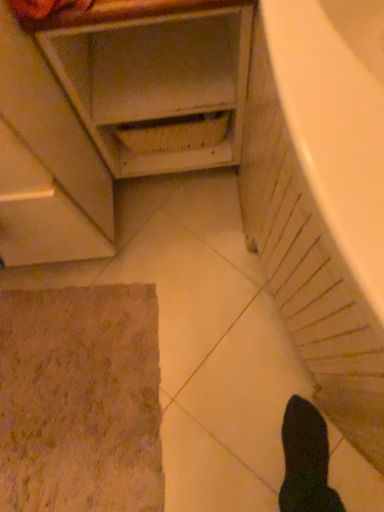
The image size is (384, 512). I want to click on matte white cabinet at upper left, so click(x=121, y=112).

Identify the location of bath mat that is behind the white glossy bathtub at lower right. (80, 400).

Which is closer to the camera, [60,302] or [360,254]?

Point [60,302] is positioned farther from the camera compared to point [360,254].

Which of these two, brown textured bath mat at lower left or white glossy bathtub at lower right, is smaller?

With smaller size is brown textured bath mat at lower left.

Can you confirm if brown textured bath mat at lower left is positioned to the right of white glossy bathtub at lower right?

No.

Looking at this image, based on their sizes in the image, would you say matte white cabinet at upper left is bigger or smaller than brown textured bath mat at lower left?

In the image, matte white cabinet at upper left appears to be larger than brown textured bath mat at lower left.

In the scene shown: Is matte white cabinet at upper left far away from brown textured bath mat at lower left?

They are positioned close to each other.

Can you confirm if matte white cabinet at upper left is positioned to the left of brown textured bath mat at lower left?

Incorrect, matte white cabinet at upper left is not on the left side of brown textured bath mat at lower left.

Considering the positions of objects matte white cabinet at upper left and brown textured bath mat at lower left in the image provided, who is behind, matte white cabinet at upper left or brown textured bath mat at lower left?

brown textured bath mat at lower left.

Is white glossy bathtub at lower right to the left of brown textured bath mat at lower left from the viewer's perspective?

Incorrect, white glossy bathtub at lower right is not on the left side of brown textured bath mat at lower left.

From a real-world perspective, between white glossy bathtub at lower right and brown textured bath mat at lower left, who is vertically lower?

From a 3D spatial view, brown textured bath mat at lower left is below.

Measure the distance from white glossy bathtub at lower right to brown textured bath mat at lower left.

19.75 inches.

Is white glossy bathtub at lower right facing towards brown textured bath mat at lower left?

Yes, white glossy bathtub at lower right is turned towards brown textured bath mat at lower left.

From a real-world perspective, is white glossy bathtub at lower right located higher than matte white cabinet at upper left?

Yes, from a real-world perspective, white glossy bathtub at lower right is above matte white cabinet at upper left.

In the scene shown: Would you say white glossy bathtub at lower right is a long distance from matte white cabinet at upper left?

white glossy bathtub at lower right is actually quite close to matte white cabinet at upper left.

Is white glossy bathtub at lower right to the left of matte white cabinet at upper left from the viewer's perspective?

Incorrect, white glossy bathtub at lower right is not on the left side of matte white cabinet at upper left.

In terms of height, does brown textured bath mat at lower left look taller or shorter compared to matte white cabinet at upper left?

brown textured bath mat at lower left is shorter than matte white cabinet at upper left.

Is brown textured bath mat at lower left directly adjacent to matte white cabinet at upper left?

No, brown textured bath mat at lower left is not next to matte white cabinet at upper left.

Looking at the image, does brown textured bath mat at lower left seem bigger or smaller compared to matte white cabinet at upper left?

Clearly, brown textured bath mat at lower left is smaller in size than matte white cabinet at upper left.

Is matte white cabinet at upper left bigger or smaller than white glossy bathtub at lower right?

matte white cabinet at upper left is smaller than white glossy bathtub at lower right.

Is matte white cabinet at upper left not close to white glossy bathtub at lower right?

No.

Considering the sizes of objects matte white cabinet at upper left and white glossy bathtub at lower right in the image provided, who is thinner, matte white cabinet at upper left or white glossy bathtub at lower right?

Thinner between the two is matte white cabinet at upper left.

At what (x,y) coordinates should I click in order to perform the action: click on bath in front of the brown textured bath mat at lower left. Please return your answer as a coordinate pair (x, y). The width and height of the screenshot is (384, 512). Looking at the image, I should click on (322, 196).

The height and width of the screenshot is (512, 384). Find the location of `cabinetry above the brown textured bath mat at lower left (from a real-world perspective)`. cabinetry above the brown textured bath mat at lower left (from a real-world perspective) is located at coordinates (121, 112).

Based on their spatial positions, is matte white cabinet at upper left or brown textured bath mat at lower left further from white glossy bathtub at lower right?

The object further to white glossy bathtub at lower right is brown textured bath mat at lower left.

From the image, which object appears to be farther from matte white cabinet at upper left, brown textured bath mat at lower left or white glossy bathtub at lower right?

brown textured bath mat at lower left lies further to matte white cabinet at upper left than the other object.

From the image, which object appears to be farther from matte white cabinet at upper left, white glossy bathtub at lower right or brown textured bath mat at lower left?

Among the two, brown textured bath mat at lower left is located further to matte white cabinet at upper left.

Looking at the image, which one is located further to brown textured bath mat at lower left, matte white cabinet at upper left or white glossy bathtub at lower right?

white glossy bathtub at lower right.

When comparing their distances from brown textured bath mat at lower left, does white glossy bathtub at lower right or matte white cabinet at upper left seem further?

Among the two, white glossy bathtub at lower right is located further to brown textured bath mat at lower left.

Which object lies nearer to the anchor point white glossy bathtub at lower right, brown textured bath mat at lower left or matte white cabinet at upper left?

matte white cabinet at upper left lies closer to white glossy bathtub at lower right than the other object.

Find the location of a particular element. This screenshot has width=384, height=512. bath that lies between matte white cabinet at upper left and brown textured bath mat at lower left from top to bottom is located at coordinates (322, 196).